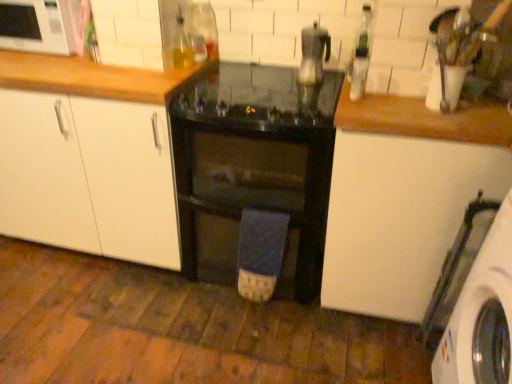
Question: Based on their sizes in the image, would you say white matte cabinet at upper right, positioned as the 1th cabinetry in right-to-left order, is bigger or smaller than green glass bottle at upper right, marked as the 1th bottle in a right-to-left arrangement?

Choices:
 (A) big
 (B) small

Answer: (A)

Question: From a real-world perspective, is white matte cabinet at upper right, positioned as the 1th cabinetry in right-to-left order, positioned above or below green glass bottle at upper right, marked as the 1th bottle in a right-to-left arrangement?

Choices:
 (A) above
 (B) below

Answer: (B)

Question: Which object is positioned closest to the white matte cabinet at center, the 3th cabinetry positioned from the right?

Choices:
 (A) satin silver coffee maker at center
 (B) green glass bottle at upper right, marked as the 1th bottle in a right-to-left arrangement
 (C) translucent plastic bottle at center, which appears as the 2th bottle when viewed from the right
 (D) white matte cabinet at upper right, positioned as the 1th cabinetry in right-to-left order
 (E) white glossy microwave at upper left

Answer: (E)

Question: Which object is the closest to the translucent plastic bottle at center, which appears as the 2th bottle when viewed from the right?

Choices:
 (A) satin silver coffee maker at center
 (B) white matte cabinet at upper right, the third cabinetry positioned from the left
 (C) green glass bottle at upper right, which is the 3th bottle from left to right
 (D) translucent glass bottle at upper center, marked as the third bottle in a right-to-left arrangement
 (E) white matte cabinet at center, the 3th cabinetry positioned from the right

Answer: (D)